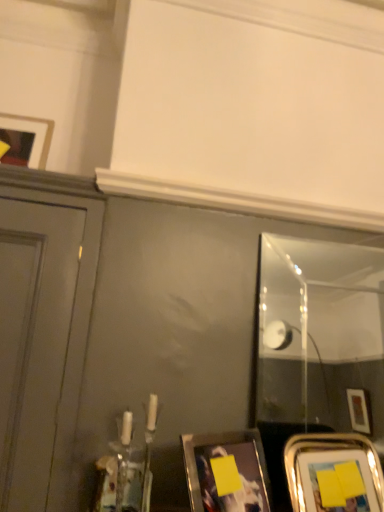
Question: From the image's perspective, is matte black picture frame at upper left, the third picture frame positioned from the right, above clear glass mirror at right?

Choices:
 (A) no
 (B) yes

Answer: (B)

Question: Does matte black picture frame at upper left, placed as the first picture frame when sorted from left to right, have a larger size compared to clear glass mirror at right?

Choices:
 (A) no
 (B) yes

Answer: (A)

Question: Is the surface of matte black picture frame at upper left, which appears as the 1th picture frame when viewed from the top, in direct contact with clear glass mirror at right?

Choices:
 (A) no
 (B) yes

Answer: (A)

Question: Is matte black picture frame at upper left, placed as the first picture frame when sorted from left to right, looking in the opposite direction of clear glass mirror at right?

Choices:
 (A) no
 (B) yes

Answer: (A)

Question: Is matte black picture frame at upper left, placed as the first picture frame when sorted from left to right, positioned before clear glass mirror at right?

Choices:
 (A) yes
 (B) no

Answer: (B)

Question: Considering the relative positions of clear glass mirror at right and matte black picture frame at upper left, the third picture frame positioned from the right, in the image provided, is clear glass mirror at right to the left or to the right of matte black picture frame at upper left, the third picture frame positioned from the right,?

Choices:
 (A) left
 (B) right

Answer: (B)

Question: Is clear glass mirror at right bigger or smaller than matte black picture frame at upper left, which is the 3th picture frame from bottom to top?

Choices:
 (A) big
 (B) small

Answer: (A)

Question: Considering the positions of point (297, 424) and point (28, 116), is point (297, 424) closer or farther from the camera than point (28, 116)?

Choices:
 (A) closer
 (B) farther

Answer: (B)

Question: Is clear glass mirror at right inside or outside of matte black picture frame at upper left, placed as the first picture frame when sorted from left to right?

Choices:
 (A) inside
 (B) outside

Answer: (B)

Question: From a real-world perspective, is metallic silver picture frame at lower right, marked as the first picture frame in a bottom-to-top arrangement, above or below matte black picture frame at upper left, placed as the first picture frame when sorted from left to right?

Choices:
 (A) above
 (B) below

Answer: (B)

Question: From the image's perspective, relative to matte black picture frame at upper left, which appears as the 1th picture frame when viewed from the top, is metallic silver picture frame at lower right, marked as the first picture frame in a bottom-to-top arrangement, above or below?

Choices:
 (A) above
 (B) below

Answer: (B)

Question: Based on their sizes in the image, would you say metallic silver picture frame at lower right, marked as the first picture frame in a bottom-to-top arrangement, is bigger or smaller than matte black picture frame at upper left, placed as the first picture frame when sorted from left to right?

Choices:
 (A) big
 (B) small

Answer: (A)

Question: Considering the positions of metallic silver picture frame at lower right, marked as the first picture frame in a bottom-to-top arrangement, and matte black picture frame at upper left, which is the 3th picture frame from bottom to top, in the image, is metallic silver picture frame at lower right, marked as the first picture frame in a bottom-to-top arrangement, wider or thinner than matte black picture frame at upper left, which is the 3th picture frame from bottom to top,?

Choices:
 (A) thin
 (B) wide

Answer: (B)

Question: In the image, is yellow matte picture frame at lower center, arranged as the second picture frame when viewed from the right, on the left side or the right side of clear glass mirror at right?

Choices:
 (A) right
 (B) left

Answer: (B)

Question: Relative to clear glass mirror at right, is yellow matte picture frame at lower center, positioned as the 2th picture frame in left-to-right order, in front or behind?

Choices:
 (A) behind
 (B) front

Answer: (B)